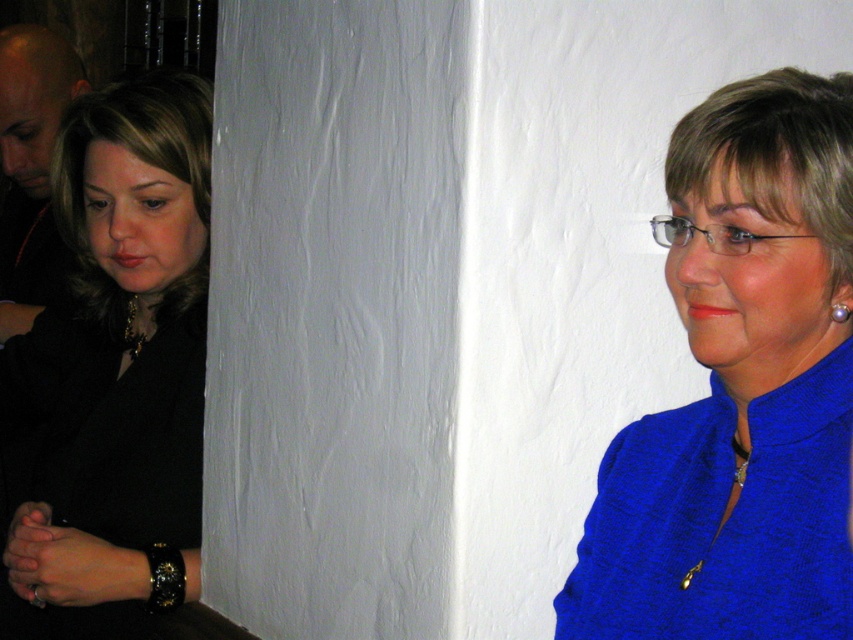
Based on the scene description, where is the blue fabric at upper right located in terms of its 2D coordinates?

The blue fabric at upper right is located at the 2D coordinates point (740, 387).

You are taking a photo of two points in the scene. The first point is at coordinate point(x=49, y=596) and the second is at point(x=158, y=604). Which point will appear larger in your photo?

Point(x=49, y=596) is closer to the camera than point(x=158, y=604), so it will appear larger in the photo.